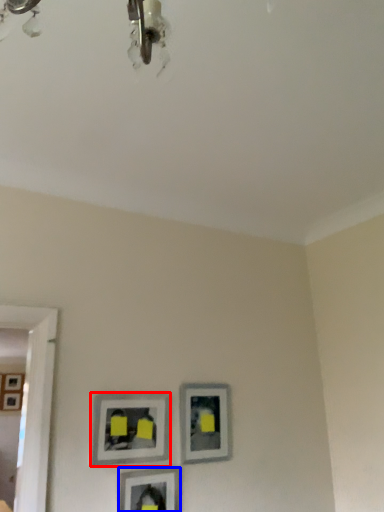
Question: Which point is further to the camera, picture frame (highlighted by a red box) or picture frame (highlighted by a blue box)?

Choices:
 (A) picture frame
 (B) picture frame

Answer: (A)